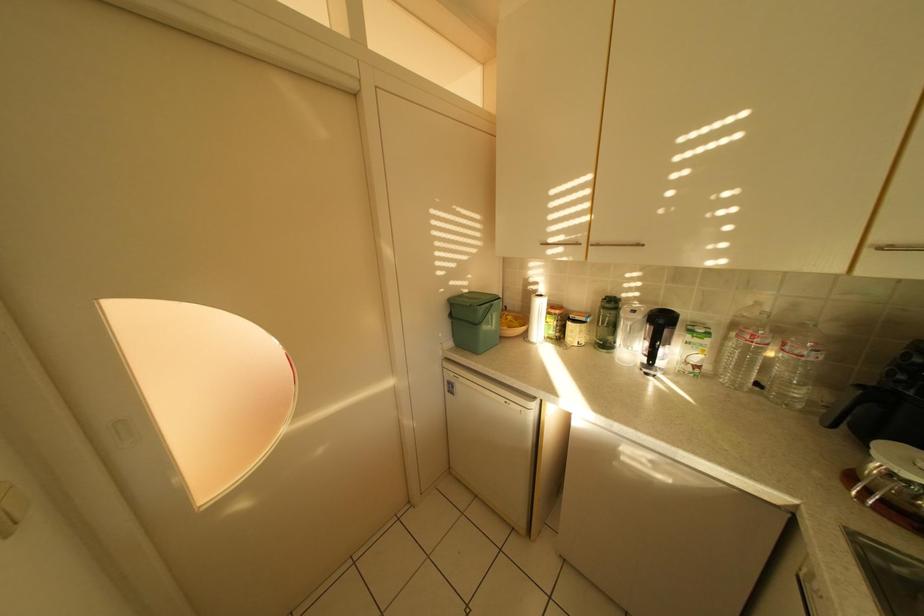
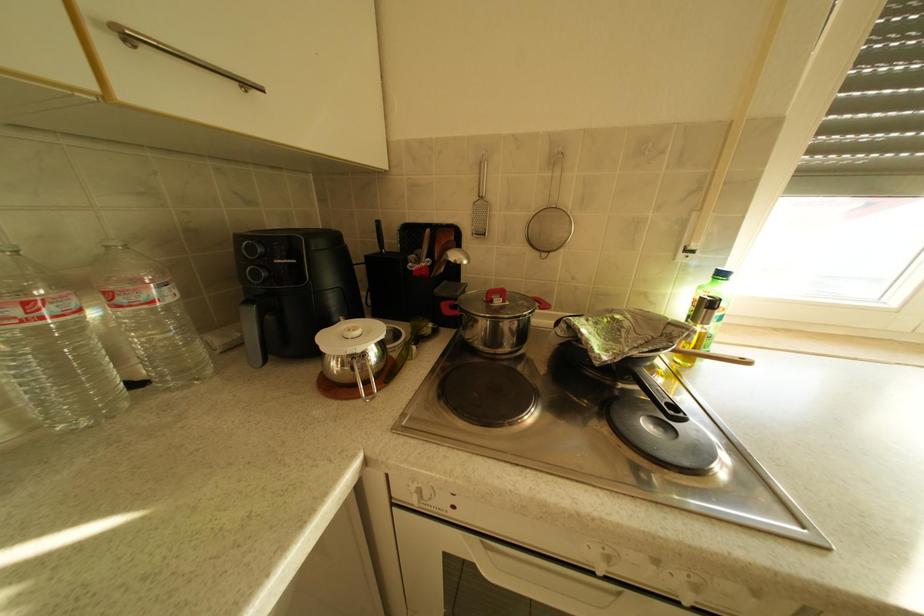
First-person continuous shooting, in which direction is the camera rotating?

The camera rotated toward right-down.